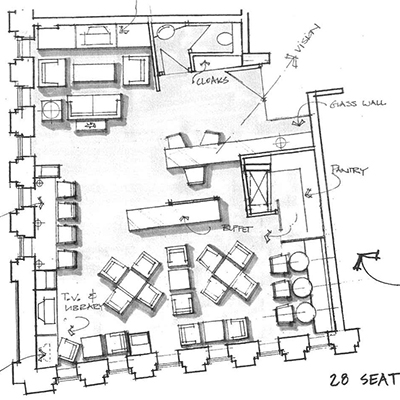
Find the location of a particular element. Image resolution: width=400 pixels, height=400 pixels. couch is located at coordinates (88, 105).